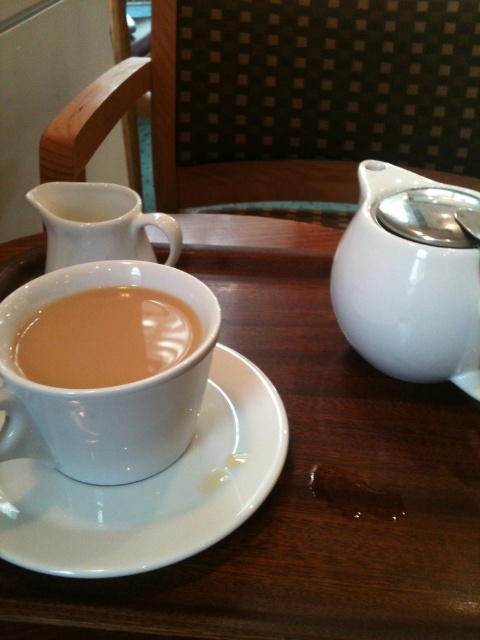
Between point (350, 584) and point (116, 369), which one is positioned in front?

Positioned in front is point (350, 584).

Which is more to the right, white glossy table at center or matte ceramic cup at center?

From the viewer's perspective, white glossy table at center appears more on the right side.

Identify the location of white glossy table at center. (302, 483).

Between white glossy table at center and white glossy teapot at upper right, which one appears on the left side from the viewer's perspective?

From the viewer's perspective, white glossy table at center appears more on the left side.

Is white glossy table at center above white glossy teapot at upper right?

No.

Between point (202, 560) and point (456, 256), which one is positioned in front?

Point (202, 560)

What are the coordinates of `white glossy table at center` in the screenshot? It's located at (302, 483).

Is white glossy table at center behind matte ceramic cup at center-left?

No, white glossy table at center is closer to the viewer.

Can you confirm if white glossy table at center is positioned above matte ceramic cup at center-left?

Actually, white glossy table at center is below matte ceramic cup at center-left.

Is point (213, 243) farther from viewer compared to point (91, 452)?

That is True.

Identify the location of white glossy table at center. This screenshot has height=640, width=480. (302, 483).